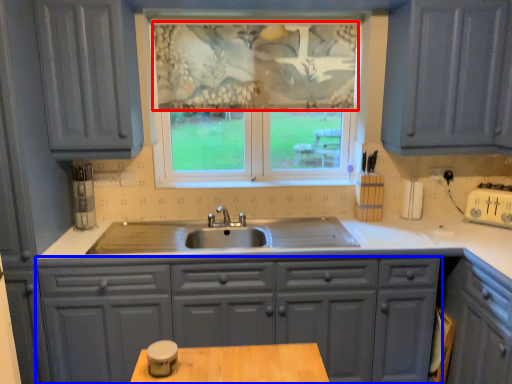
Question: Which object is further to the camera taking this photo, curtain (highlighted by a red box) or cabinetry (highlighted by a blue box)?

Choices:
 (A) curtain
 (B) cabinetry

Answer: (A)